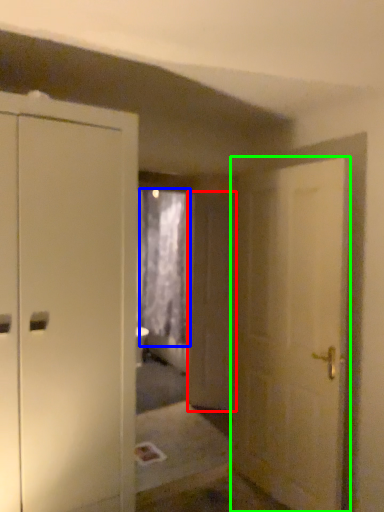
Question: Which object is positioned closest to screen door (highlighted by a red box)? Select from curtain (highlighted by a blue box) and door (highlighted by a green box).

Choices:
 (A) curtain
 (B) door

Answer: (B)